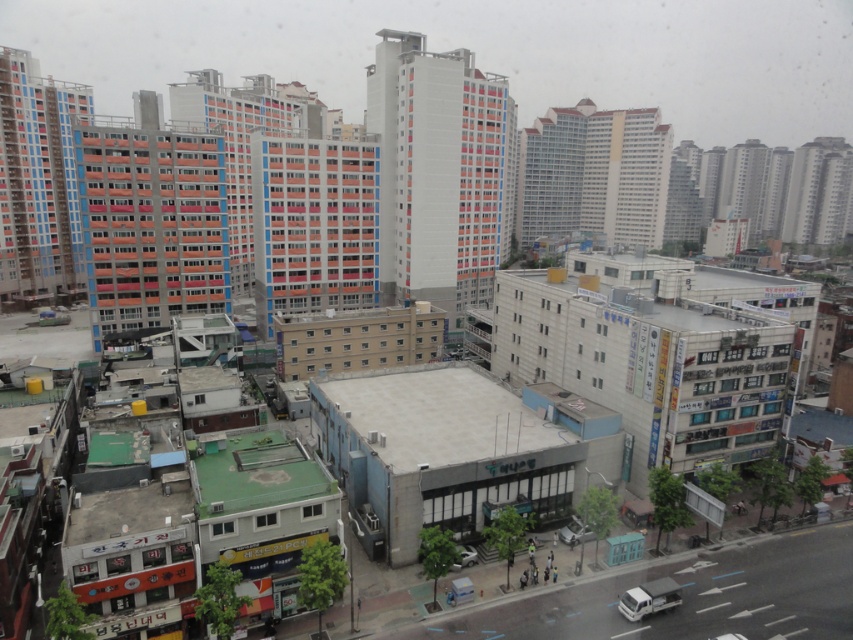
You are a delivery driver trying to locate the white matte van at lower right in a city scene. Using a coordinate system where the bottom left corner is the origin, can you confirm if the van is positioned closer to the right edge of the image than the top edge?

The white matte van at lower right is located at coordinates approximately 0.936 on the x axis and 0.762 on the y axis. Since the x coordinate measures horizontal distance from the left edge and the y coordinate measures vertical distance from the bottom edge, comparing these values to the image boundaries shows that the van is closer to the right edge than the top edge.

You are standing at the center of the scene looking towards the lower right. There is a point marked at coordinates (648, 598). What object is located at this point?

The point at coordinates (648, 598) marks the location of the white matte van at lower right.

You are a delivery person trying to park your white matte car at center in a parking spot that has a height restriction of 1.5 meters. The parking spot is near the metallic silver car at center. Can your car fit under the height limit?

The white matte car at center has a lesser height compared to the metallic silver car at center. Since the height restriction is 1.5 meters, if the metallic silver car at center exceeds this limit, the white matte car at center might still fit. However, without knowing the exact height of the metallic silver car at center, it is uncertain whether the white matte car at center meets the requirement.